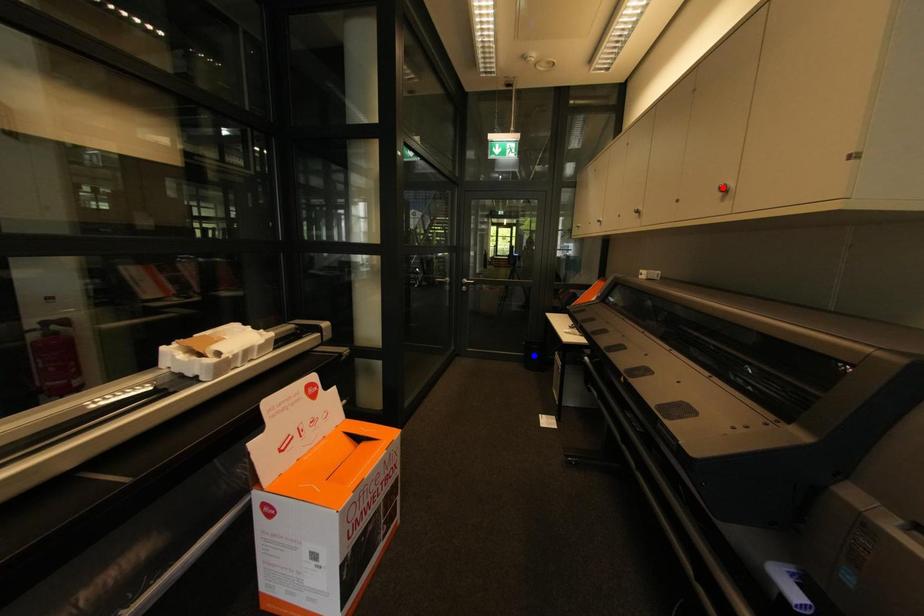
Question: In the image, two points are highlighted. Which point is nearer to the camera? Reply with the corresponding letter.

Choices:
 (A) blue point
 (B) red point

Answer: (B)